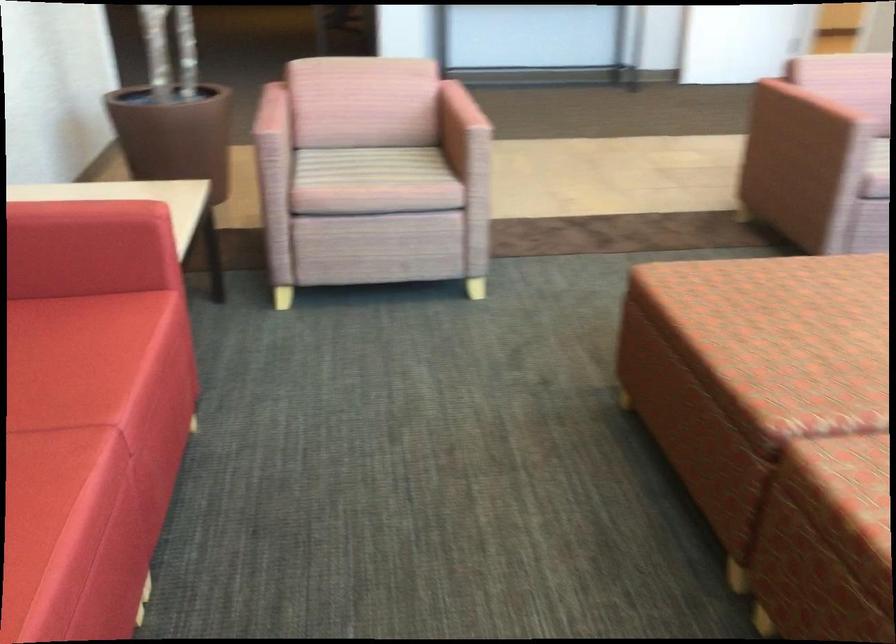
This screenshot has width=896, height=644. Find the location of `pink chair sitting surface`. pink chair sitting surface is located at coordinates (365, 166).